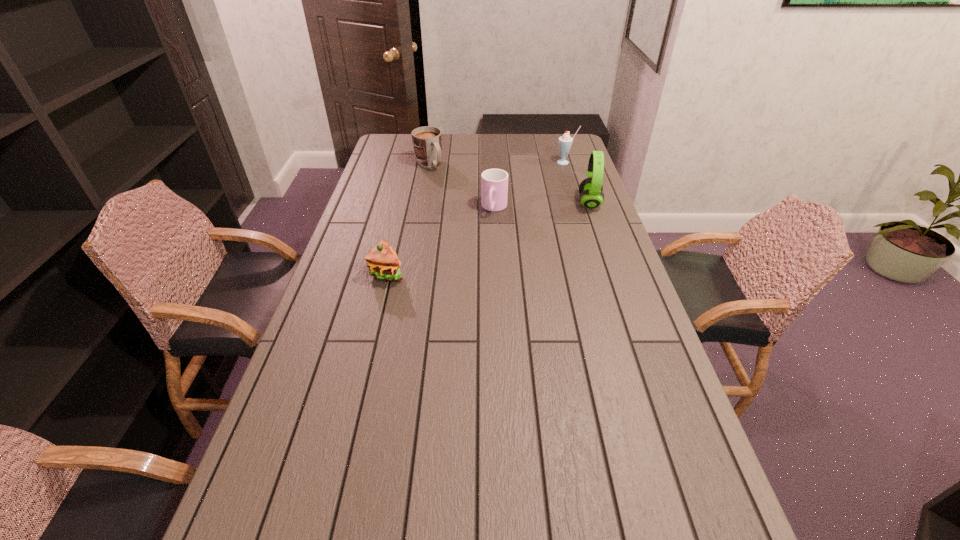
Locate an element on the screen. This screenshot has height=540, width=960. free point between the third object from right to left and the nearest object is located at coordinates (441, 240).

Identify the location of free area in between the milkshake and the mug. (497, 164).

The width and height of the screenshot is (960, 540). Find the location of `free space between the cup and the nearest object`. free space between the cup and the nearest object is located at coordinates (441, 240).

The height and width of the screenshot is (540, 960). What are the coordinates of `vacant region between the second tallest object and the tallest object` in the screenshot? It's located at (578, 183).

The height and width of the screenshot is (540, 960). In order to click on free space between the tallest object and the second tallest object in this screenshot , I will do `click(578, 183)`.

Where is `vacant space that's between the headset and the mug`? vacant space that's between the headset and the mug is located at coordinates (509, 184).

The image size is (960, 540). What are the coordinates of `object that is the third closest to the milkshake` in the screenshot? It's located at (427, 141).

Identify the location of the third closest object to the mug. This screenshot has height=540, width=960. (591, 193).

Locate an element on the screen. vacant region that satisfies the following two spatial constraints: 1. on the back side of the sandwich; 2. on the right side of the tallest object is located at coordinates (404, 204).